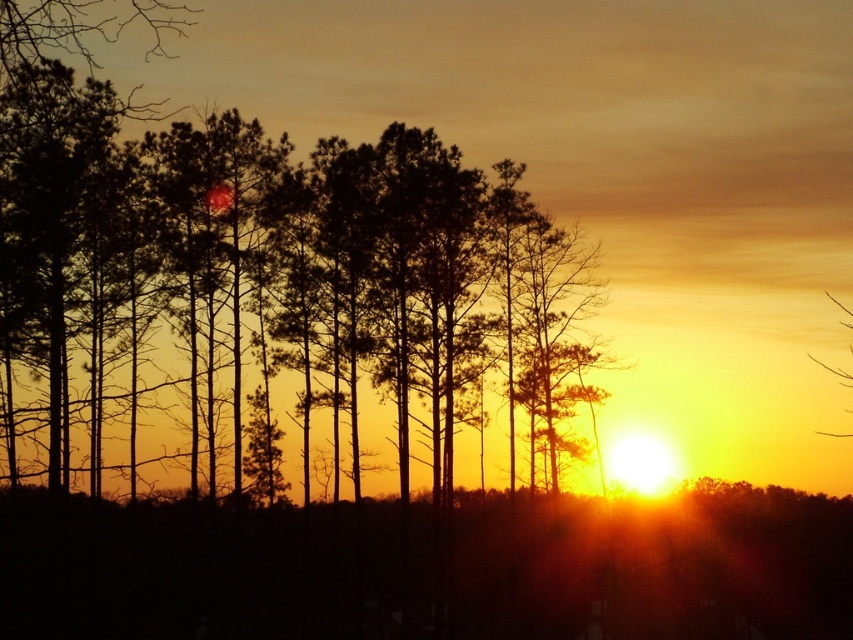
You are standing at the point labeled point [276,273] in the sunset scene. What object are you touching?

The point labeled point [276,273] is on the silhouette tree at center, so you are touching the silhouette tree at center.